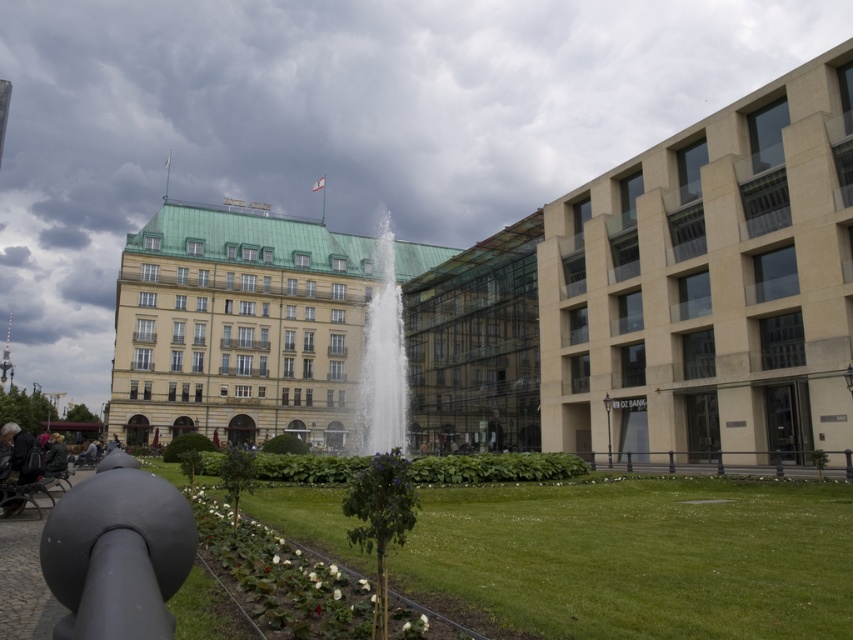
Question: Is wooden park bench at lower left to the left of dark gray fabric jacket at lower left from the viewer's perspective?

Choices:
 (A) no
 (B) yes

Answer: (A)

Question: Which point is closer to the camera?

Choices:
 (A) dark gray leather jacket at lower left
 (B) dark gray fabric jacket at lower left

Answer: (A)

Question: Which of the following is the farthest from the observer?

Choices:
 (A) dark gray fabric jacket at lower left
 (B) clear water fountain at center
 (C) matte black cannon at lower left

Answer: (B)

Question: Among these objects, which one is nearest to the camera?

Choices:
 (A) dark gray fabric jacket at lower left
 (B) cloudy sky at upper center

Answer: (A)

Question: Does cloudy sky at upper center appear on the right side of dark gray fabric jacket at lower left?

Choices:
 (A) no
 (B) yes

Answer: (B)

Question: Does wooden park bench at lower left appear on the right side of dark gray fabric jacket at lower left?

Choices:
 (A) yes
 (B) no

Answer: (A)